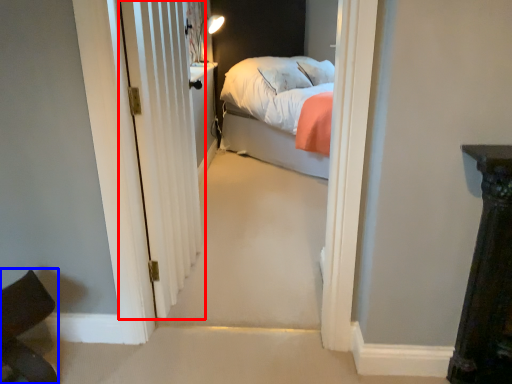
Question: Among these objects, which one is farthest to the camera, door (highlighted by a red box) or chair (highlighted by a blue box)?

Choices:
 (A) door
 (B) chair

Answer: (A)